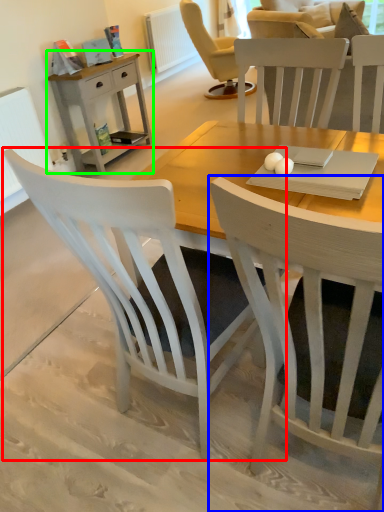
Question: Which object is positioned closest to chair (highlighted by a red box)? Select from chair (highlighted by a blue box) and nightstand (highlighted by a green box).

Choices:
 (A) chair
 (B) nightstand

Answer: (A)